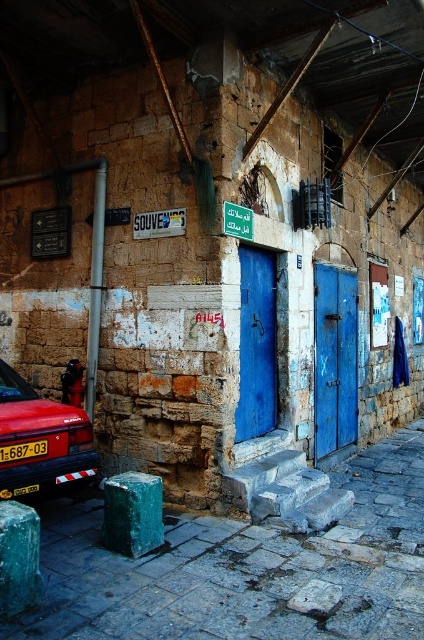
You are standing at the entrance of the weathered stone building with two blue doors. You need to reach the smooth concrete steps at lower center. Which direction should you move to reach them?

To reach the smooth concrete steps at lower center, you should move forward since they are located directly ahead at point (248, 568).

You are a delivery person trying to deliver a package to the address shown in the image. The package requires a signature, so you need to locate the entrance. Based on the scene, which object should you approach first, the blue painted wood door at center or the green textured block at lower center?

The blue painted wood door at center is the entrance since it is larger in size than the green textured block at lower center, which is likely a decorative or structural element.

You are a delivery person trying to reach the blue painted wood door at center. You are currently standing on the smooth concrete steps at lower center. Which direction should you move to reach the door?

The smooth concrete steps at lower center is located below the blue painted wood door at center, so you should move upward towards the blue painted wood door at center to reach it.